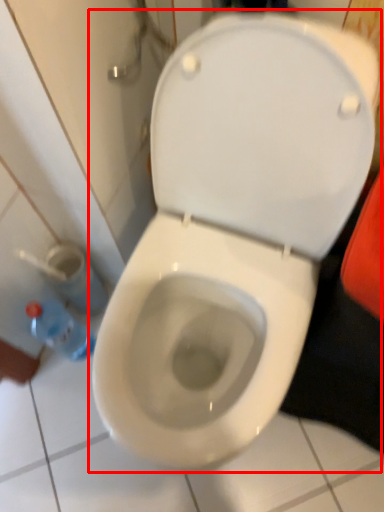
Question: From the image's perspective, where is toilet (annotated by the red box) located in relation to bottle in the image?

Choices:
 (A) below
 (B) above

Answer: (B)